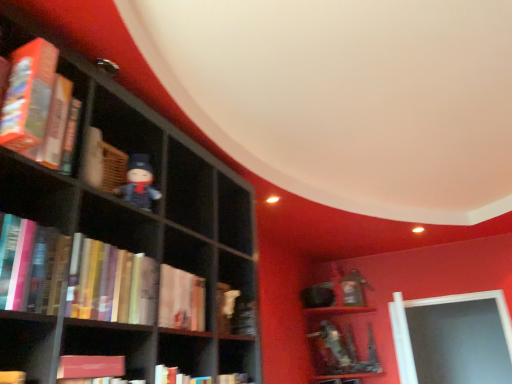
Question: Is hardcover book at center, the fourth book when ordered from top to bottom, at the back of matte black figurine at center-left?

Choices:
 (A) no
 (B) yes

Answer: (A)

Question: From the image's perspective, is matte black figurine at center-left under hardcover book at center, which is the first book from bottom to top?

Choices:
 (A) yes
 (B) no

Answer: (B)

Question: Would you say matte black figurine at center-left is outside hardcover book at center, the fourth book when ordered from top to bottom?

Choices:
 (A) yes
 (B) no

Answer: (A)

Question: Does matte black figurine at center-left have a greater width compared to hardcover book at center, which is the first book from bottom to top?

Choices:
 (A) no
 (B) yes

Answer: (A)

Question: Is matte black figurine at center-left beside hardcover book at center, the fourth book when ordered from top to bottom?

Choices:
 (A) yes
 (B) no

Answer: (B)

Question: Is matte black figurine at center-left bigger than hardcover book at center, the fourth book when ordered from top to bottom?

Choices:
 (A) no
 (B) yes

Answer: (A)

Question: Can you confirm if hardcover book at left, marked as the first book in a top-to-bottom arrangement, is positioned to the left of matte black figurine at center-left?

Choices:
 (A) no
 (B) yes

Answer: (B)

Question: Would you say hardcover book at left, marked as the first book in a top-to-bottom arrangement, contains matte black figurine at center-left?

Choices:
 (A) yes
 (B) no

Answer: (B)

Question: Are hardcover book at left, marked as the first book in a top-to-bottom arrangement, and matte black figurine at center-left located far from each other?

Choices:
 (A) no
 (B) yes

Answer: (A)

Question: Is hardcover book at left, which is the fourth book in bottom-to-top order, facing away from matte black figurine at center-left?

Choices:
 (A) no
 (B) yes

Answer: (A)

Question: Is hardcover book at left, marked as the first book in a top-to-bottom arrangement, next to matte black figurine at center-left and touching it?

Choices:
 (A) no
 (B) yes

Answer: (A)

Question: Can we say hardcover book at left, marked as the first book in a top-to-bottom arrangement, lies outside matte black figurine at center-left?

Choices:
 (A) no
 (B) yes

Answer: (B)

Question: Does hardcover book at left, which ranks as the 2th book in top-to-bottom order, appear on the right side of matte black figurine at center-left?

Choices:
 (A) no
 (B) yes

Answer: (A)